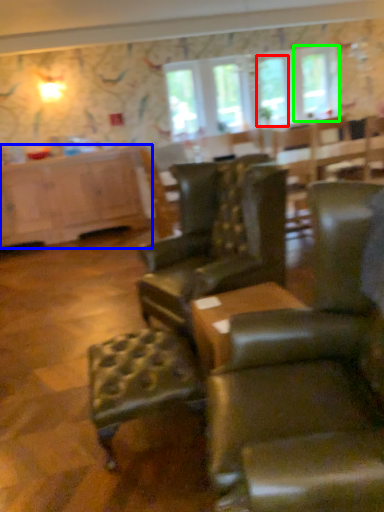
Question: Which object is the closest to the window screen (highlighted by a red box)? Choose among these: cabinetry (highlighted by a blue box) or window (highlighted by a green box).

Choices:
 (A) cabinetry
 (B) window

Answer: (B)